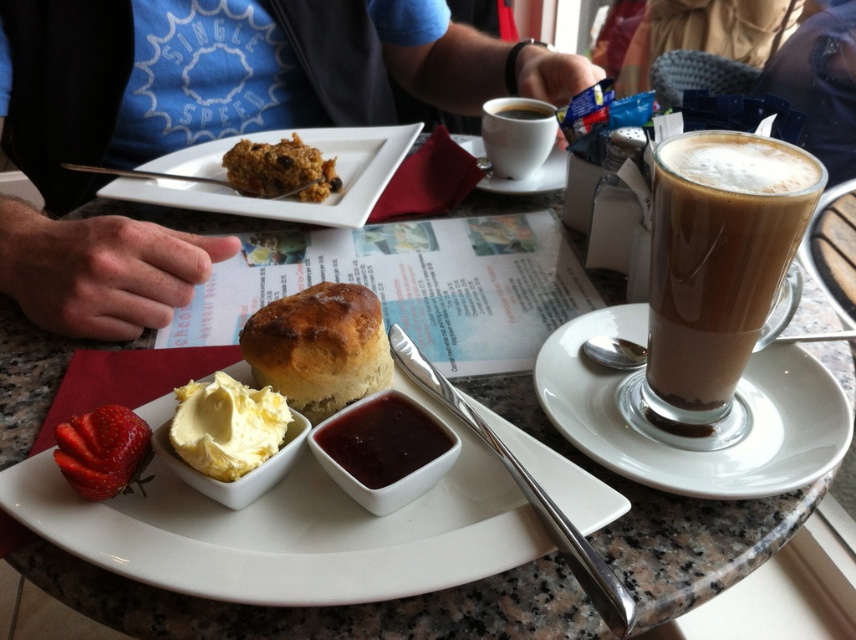
Question: Which of the following is the farthest from the observer?

Choices:
 (A) (343, 304)
 (B) (770, 304)
 (C) (639, 438)

Answer: (C)

Question: Can you confirm if yellow creamy butter at center is positioned to the left of black matte cup at upper center?

Choices:
 (A) no
 (B) yes

Answer: (B)

Question: Is blue cotton shirt at upper left below dark glossy jam at center?

Choices:
 (A) yes
 (B) no

Answer: (B)

Question: Does white ceramic saucer at right appear on the right side of dark glossy jam at center?

Choices:
 (A) yes
 (B) no

Answer: (A)

Question: Which point appears farthest from the camera in this image?

Choices:
 (A) (61, 268)
 (B) (64, 451)

Answer: (A)

Question: Which point is farther to the camera?

Choices:
 (A) (753, 150)
 (B) (431, 83)
 (C) (525, 113)
 (D) (360, 467)

Answer: (B)